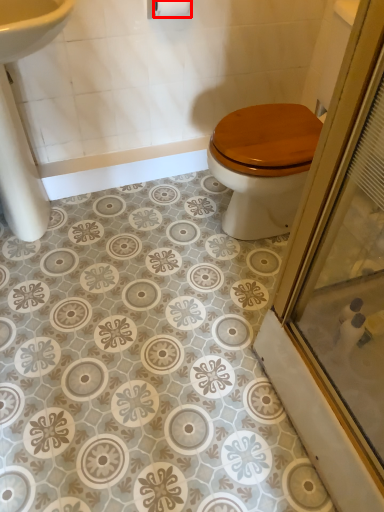
Question: From the image's perspective, where is toilet paper (annotated by the red box) located in relation to sink in the image?

Choices:
 (A) above
 (B) below

Answer: (A)